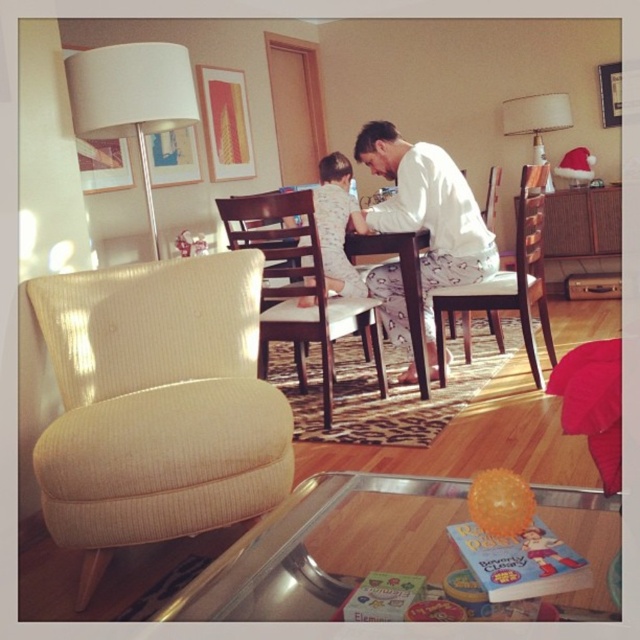
Can you confirm if wooden chair at center is smaller than white pajama at center?

No.

Does wooden chair at center appear on the left side of white pajama at center?

Yes, wooden chair at center is to the left of white pajama at center.

Between point (298, 308) and point (339, 177), which one is positioned in front?

Point (298, 308) is more forward.

You are a GUI agent. You are given a task and a screenshot of the screen. Output one action in this format:
    pyautogui.click(x=<x>, y=<y>)
    Task: Click on the wooden chair at center
    The image size is (640, 640).
    Given the screenshot: What is the action you would take?
    pyautogui.click(x=298, y=285)

Can you confirm if beige textured armchair at left is positioned below transparent glass table at lower center?

No, beige textured armchair at left is not below transparent glass table at lower center.

Is beige textured armchair at left to the left of transparent glass table at lower center from the viewer's perspective?

Correct, you'll find beige textured armchair at left to the left of transparent glass table at lower center.

What do you see at coordinates (156, 404) in the screenshot? Image resolution: width=640 pixels, height=640 pixels. I see `beige textured armchair at left` at bounding box center [156, 404].

Locate an element on the screen. The width and height of the screenshot is (640, 640). beige textured armchair at left is located at coordinates (156, 404).

Can you confirm if white cotton shirt at center is smaller than white fabric armchair at center?

No.

Does white cotton shirt at center lie behind white fabric armchair at center?

Yes, white cotton shirt at center is behind white fabric armchair at center.

Locate an element on the screen. Image resolution: width=640 pixels, height=640 pixels. white cotton shirt at center is located at coordinates click(428, 212).